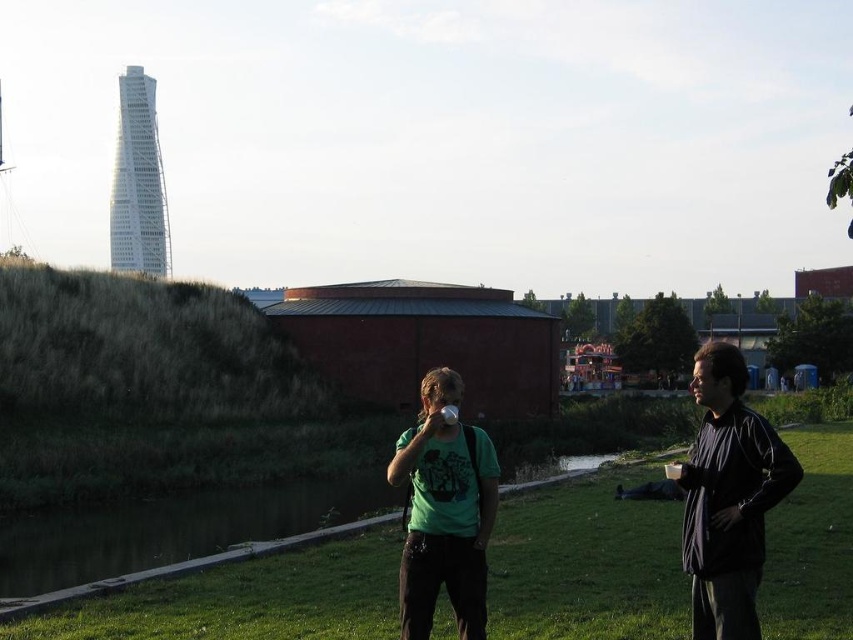
Question: Based on their relative distances, which object is farther from the green matte shirt at center?

Choices:
 (A) green grass at center
 (B) black matte jacket at right

Answer: (A)

Question: Among these objects, which one is nearest to the camera?

Choices:
 (A) green matte shirt at center
 (B) green grass at center
 (C) green matte t-shirt at center

Answer: (C)

Question: Among these points, which one is nearest to the camera?

Choices:
 (A) (457, 448)
 (B) (772, 428)
 (C) (161, 595)

Answer: (B)

Question: Is black matte jacket at right behind green matte shirt at center?

Choices:
 (A) no
 (B) yes

Answer: (A)

Question: Considering the relative positions of green grass at center and green matte t-shirt at center in the image provided, where is green grass at center located with respect to green matte t-shirt at center?

Choices:
 (A) above
 (B) below

Answer: (B)

Question: Does black matte jacket at right come in front of green matte shirt at center?

Choices:
 (A) yes
 (B) no

Answer: (A)